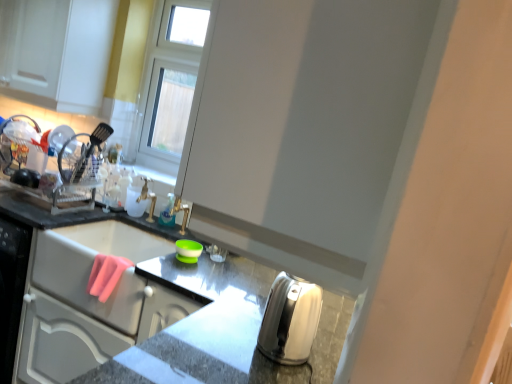
In order to click on vacant space in front of green rubber bowl at center, the 2th appliance viewed from the front in this screenshot , I will do `click(193, 272)`.